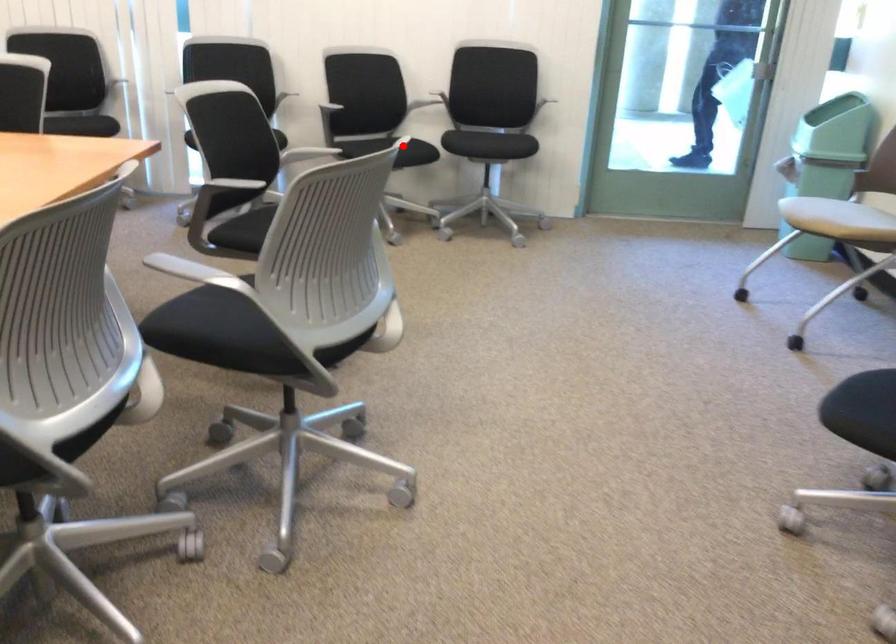
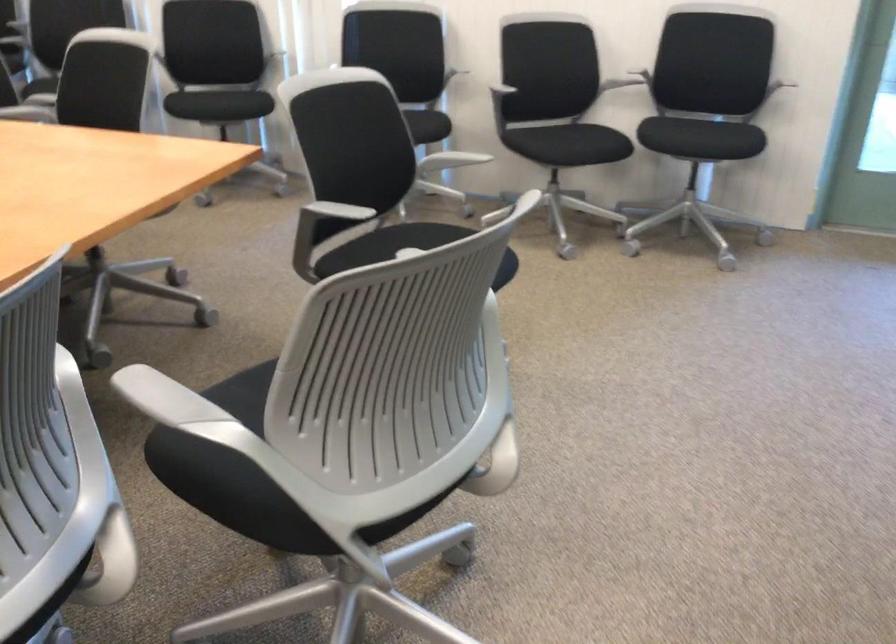
Locate, in the second image, the point that corresponds to the highlighted location in the first image.

(579, 144)